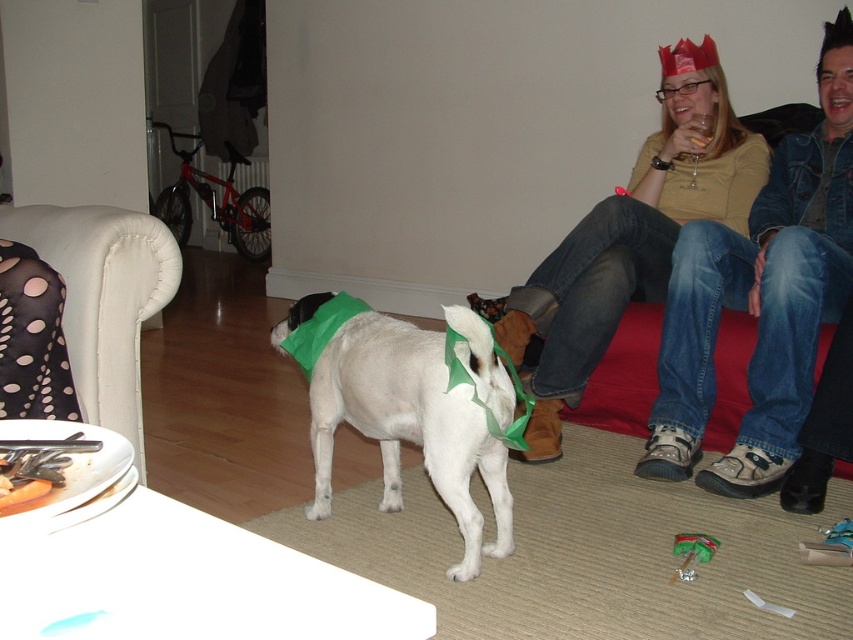
Question: Which point is closer to the camera?

Choices:
 (A) matte yellow shirt at upper right
 (B) white fabric armchair at left
 (C) white fabric dog at center
 (D) black dotted fabric dress at left

Answer: (D)

Question: Considering the relative positions of denim jacket at upper right and matte yellow shirt at upper right in the image provided, where is denim jacket at upper right located with respect to matte yellow shirt at upper right?

Choices:
 (A) left
 (B) right

Answer: (B)

Question: Is white fabric dog at center smaller than white fabric armchair at left?

Choices:
 (A) no
 (B) yes

Answer: (A)

Question: Which point is farther from the camera taking this photo?

Choices:
 (A) (85, 401)
 (B) (602, 244)

Answer: (B)

Question: Does white fabric dog at center appear under white fabric armchair at left?

Choices:
 (A) no
 (B) yes

Answer: (B)

Question: Which of the following is the farthest from the observer?

Choices:
 (A) (722, 465)
 (B) (433, 339)
 (C) (643, 204)
 (D) (12, 234)

Answer: (C)